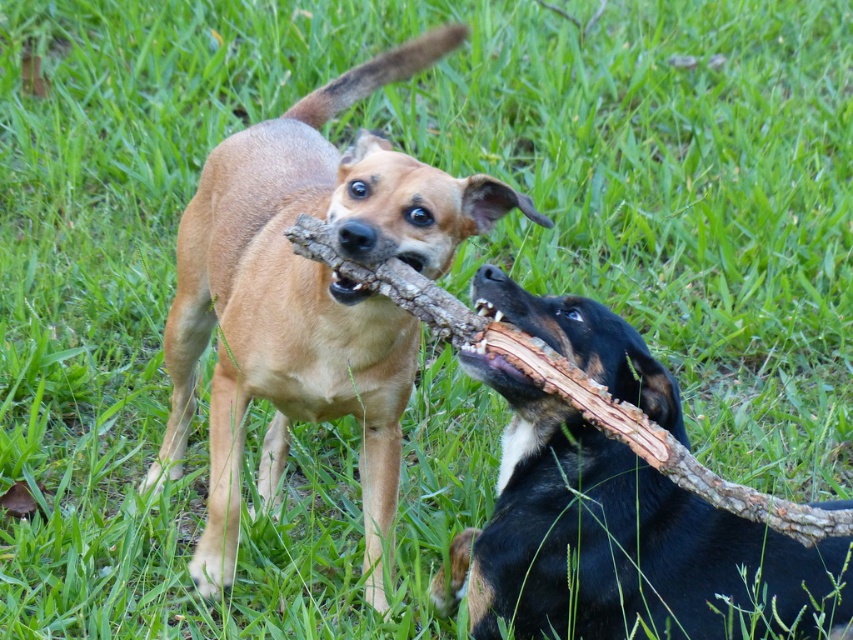
Consider the image. Is brown fur dog at center closer to the viewer compared to black smooth dog at lower right?

Yes, brown fur dog at center is closer to the viewer.

Is point (508, 189) more distant than point (527, 476)?

No, it is not.

Locate an element on the screen. brown fur dog at center is located at coordinates (310, 298).